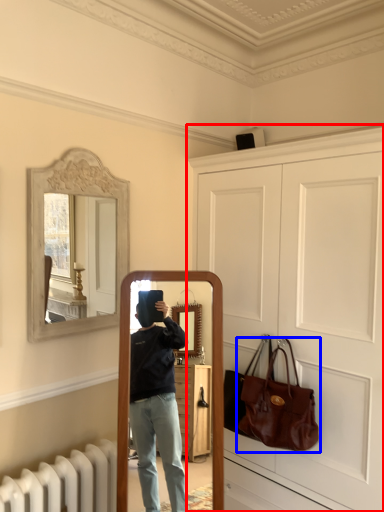
Question: Which object appears closest to the camera in this image, door (highlighted by a red box) or handbag (highlighted by a blue box)?

Choices:
 (A) door
 (B) handbag

Answer: (A)